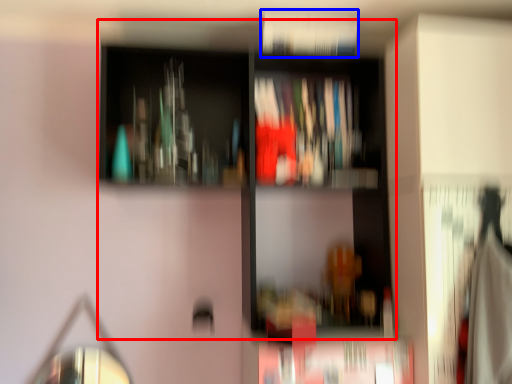
Question: Which point is closer to the camera, bookcase (highlighted by a red box) or book (highlighted by a blue box)?

Choices:
 (A) bookcase
 (B) book

Answer: (A)